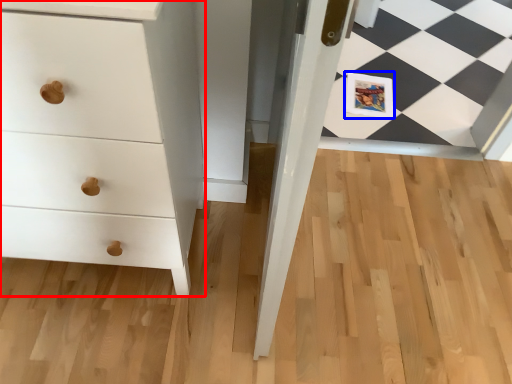
Question: Which object is closer to the camera taking this photo, chest of drawers (highlighted by a red box) or postcard (highlighted by a blue box)?

Choices:
 (A) chest of drawers
 (B) postcard

Answer: (A)